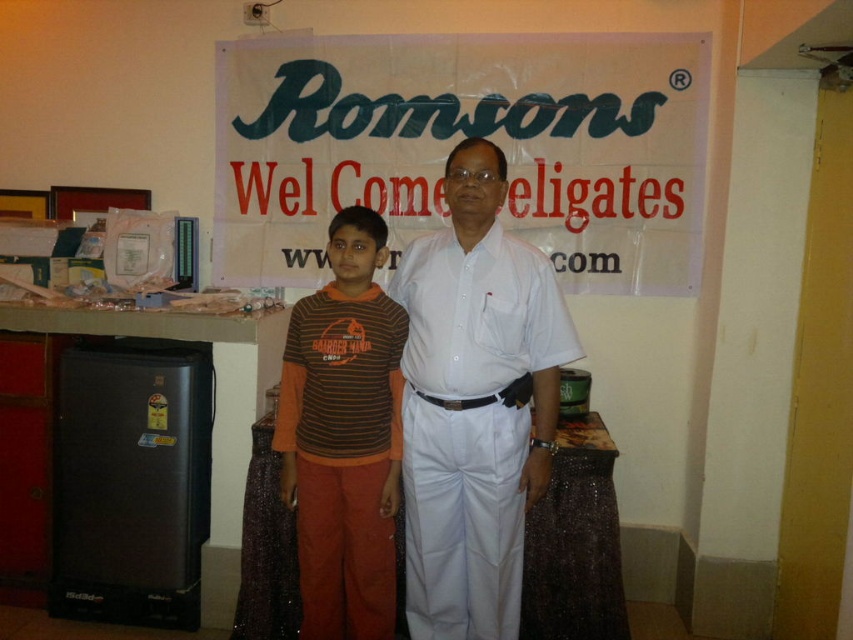
You are organizing a photo shoot and need to ensure that the white cotton shirt at center and the brown striped shirt at center are spaced exactly 20 centimeters apart for a professional look. Based on the scene described, does the current arrangement meet this requirement?

The white cotton shirt at center is 20.04 centimeters away from the brown striped shirt at center, which is very close to the desired 20 centimeters. The current arrangement meets the requirement as the difference is minimal.

You are organizing a photo shoot and need to ensure that the white cotton shirt at center and the brown striped shirt at center are visible in the final image. Based on their current positions, which shirt is more likely to be fully visible in the photo?

The white cotton shirt at center is positioned over brown striped shirt at center, so the white cotton shirt at center is more likely to be fully visible in the photo.

You are organizing a photo shoot and need to ensure that the white cotton shirt at center and the brown striped shirt at center fit within a rectangular frame. The frame can only accommodate the width of the wider shirt. Which shirt should you use to determine the minimum required frame width?

The white cotton shirt at center has a greater width than the brown striped shirt at center, so you should use the white cotton shirt at center to determine the minimum required frame width.